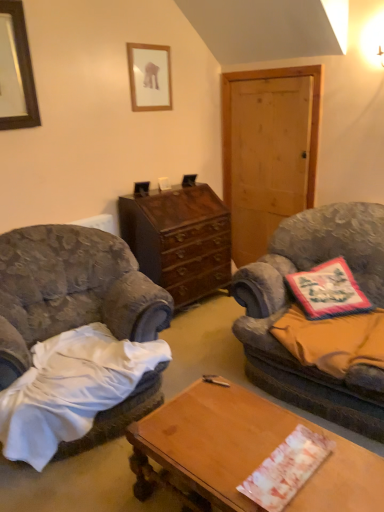
Where is `vacant space underneath white paper at center, the 1th sheet viewed from the front (from a real-world perspective)`? vacant space underneath white paper at center, the 1th sheet viewed from the front (from a real-world perspective) is located at coordinates pyautogui.click(x=285, y=467).